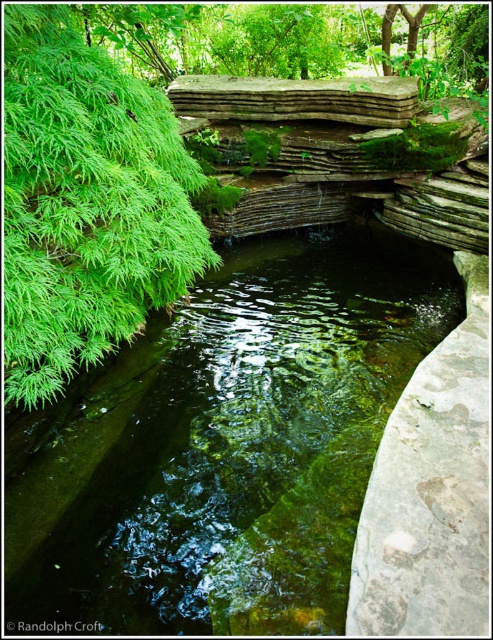
You are a gardener who wants to place a small statue that is 1.2 meters tall in the garden. Based on the scene, which object between the green mossy stone at center and the green leafy plant at left would be the better choice for the statue placement in terms of height compatibility?

The green mossy stone at center has a greater height compared to the green leafy plant at left. Therefore, placing the 1.2 meter tall statue next to the green mossy stone at center would be more compatible in terms of height since it is taller than the green leafy plant at left.

From the picture: You are a gardener planning to place a decorative statue between the green mossy stone at center and the green leafy plant at left. Based on their positions, which object should the statue be closer to?

The statue should be placed closer to the green leafy plant at left because the green mossy stone at center is positioned on the right side of the green leafy plant at left, meaning the green leafy plant is to the left of the green mossy stone. Therefore, placing the statue between them would require it to be closer to the left side where the green leafy plant is located.

You are a gardener planning to place a decorative stone sculpture that is 1 meter wide in the garden. You see the green mossy stone at center and the green leafy plant at left. Which object has a wider base to accommodate the sculpture without overcrowding the area?

The green mossy stone at center has a wider base than the green leafy plant at left, so placing the sculpture next to it would provide more space and prevent overcrowding.